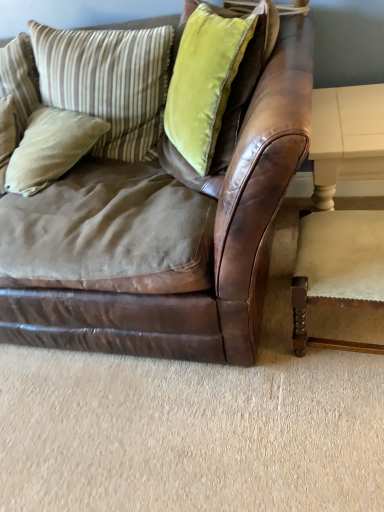
Find the location of a particular element. free space in front of beige fabric chair at lower right is located at coordinates (335, 406).